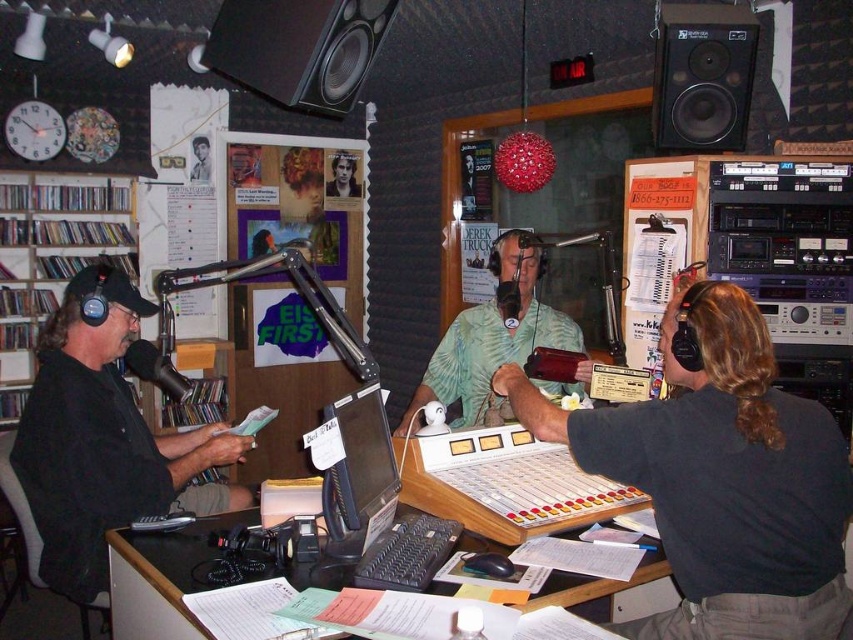
You are a technician in the radio station studio. You need to adjust the microphone stand located between the dark gray shirt at center and the matte black monitor at center. The stand is 24 inches wide. Can you safely move it without hitting either object?

The distance between dark gray shirt at center and matte black monitor at center is 23.30 inches. The microphone stand is 24 inches wide, which is slightly wider than the available space. Moving it might result in contact with either object.